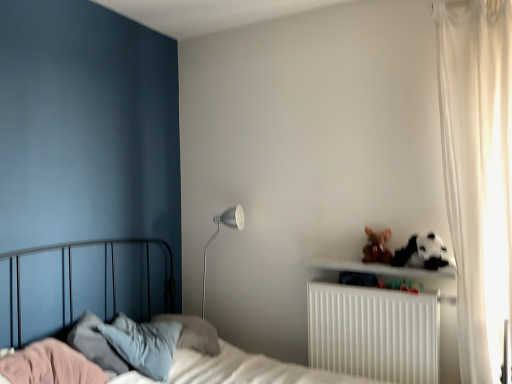
Question: Is metallic bed at left touching silver metallic floor lamp at center-left?

Choices:
 (A) yes
 (B) no

Answer: (B)

Question: Is metallic bed at left turned away from silver metallic floor lamp at center-left?

Choices:
 (A) no
 (B) yes

Answer: (A)

Question: Is metallic bed at left not inside silver metallic floor lamp at center-left?

Choices:
 (A) no
 (B) yes

Answer: (B)

Question: Is metallic bed at left smaller than silver metallic floor lamp at center-left?

Choices:
 (A) yes
 (B) no

Answer: (B)

Question: Would you say metallic bed at left is a long distance from silver metallic floor lamp at center-left?

Choices:
 (A) no
 (B) yes

Answer: (A)

Question: Is metallic bed at left bigger than silver metallic floor lamp at center-left?

Choices:
 (A) no
 (B) yes

Answer: (B)

Question: Is white plastic radiator at lower right outside of metallic bed at left?

Choices:
 (A) yes
 (B) no

Answer: (B)

Question: Considering the relative sizes of white plastic radiator at lower right and metallic bed at left in the image provided, is white plastic radiator at lower right taller than metallic bed at left?

Choices:
 (A) no
 (B) yes

Answer: (A)

Question: Is white plastic radiator at lower right surrounding metallic bed at left?

Choices:
 (A) no
 (B) yes

Answer: (A)

Question: Is metallic bed at left at the back of white plastic radiator at lower right?

Choices:
 (A) yes
 (B) no

Answer: (A)

Question: Is white plastic radiator at lower right not near metallic bed at left?

Choices:
 (A) no
 (B) yes

Answer: (A)

Question: Is white plastic radiator at lower right positioned behind metallic bed at left?

Choices:
 (A) no
 (B) yes

Answer: (B)

Question: From the image's perspective, is white sheer curtain at right over brown plush toy at upper right?

Choices:
 (A) yes
 (B) no

Answer: (A)